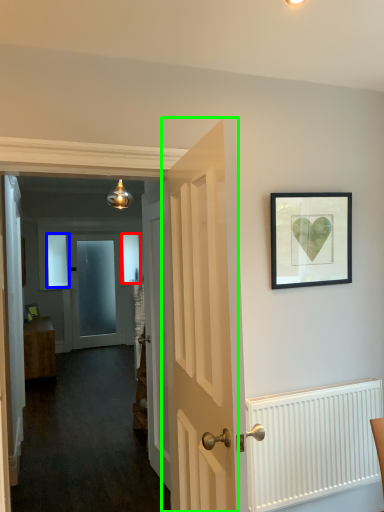
Question: Based on their relative distances, which object is farther from window (highlighted by a red box)? Choose from window (highlighted by a blue box) and door (highlighted by a green box).

Choices:
 (A) window
 (B) door

Answer: (B)